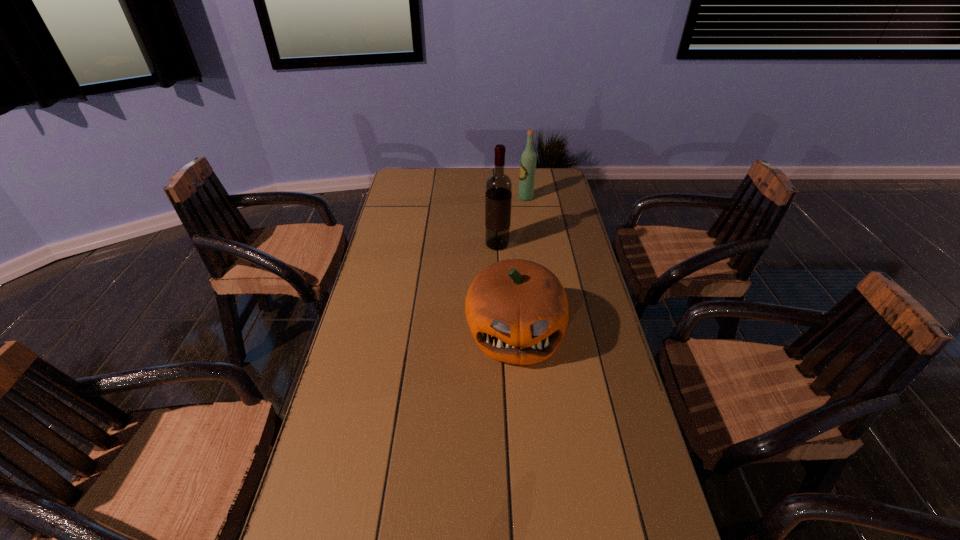
At what (x,y) coordinates should I click in order to perform the action: click on the taller wine bottle. Please return your answer as a coordinate pair (x, y). Looking at the image, I should click on (498, 196).

Locate an element on the screen. This screenshot has width=960, height=540. the tallest object is located at coordinates (498, 196).

The image size is (960, 540). Identify the location of the farthest object. (528, 160).

You are a GUI agent. You are given a task and a screenshot of the screen. Output one action in this format:
    pyautogui.click(x=<x>, y=<y>)
    Task: Click on the farther wine bottle
    The height and width of the screenshot is (540, 960).
    Given the screenshot: What is the action you would take?
    pyautogui.click(x=528, y=160)

Find the location of a particular element. pumpkin is located at coordinates (517, 311).

What are the coordinates of `the nearest object` in the screenshot? It's located at (517, 311).

The image size is (960, 540). What are the coordinates of `free space located 0.160m on the left of the nearer wine bottle` in the screenshot? It's located at (441, 244).

This screenshot has height=540, width=960. What are the coordinates of `free space located on the front-facing side of the farther wine bottle` in the screenshot? It's located at coord(421,198).

Locate an element on the screen. The image size is (960, 540). free space located on the front-facing side of the farther wine bottle is located at coordinates (474, 198).

This screenshot has width=960, height=540. What are the coordinates of `vacant region located on the front-facing side of the farther wine bottle` in the screenshot? It's located at (450, 198).